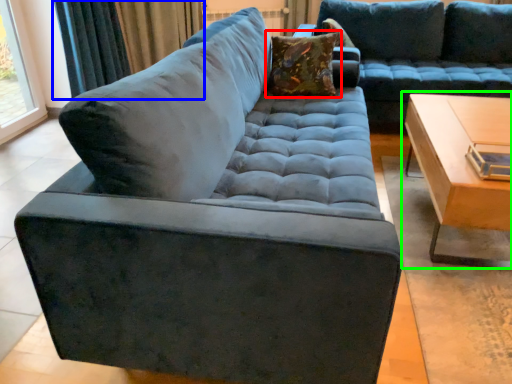
Question: Considering the real-world distances, which object is farthest from pillow (highlighted by a red box)? curtain (highlighted by a blue box) or table (highlighted by a green box)?

Choices:
 (A) curtain
 (B) table

Answer: (A)